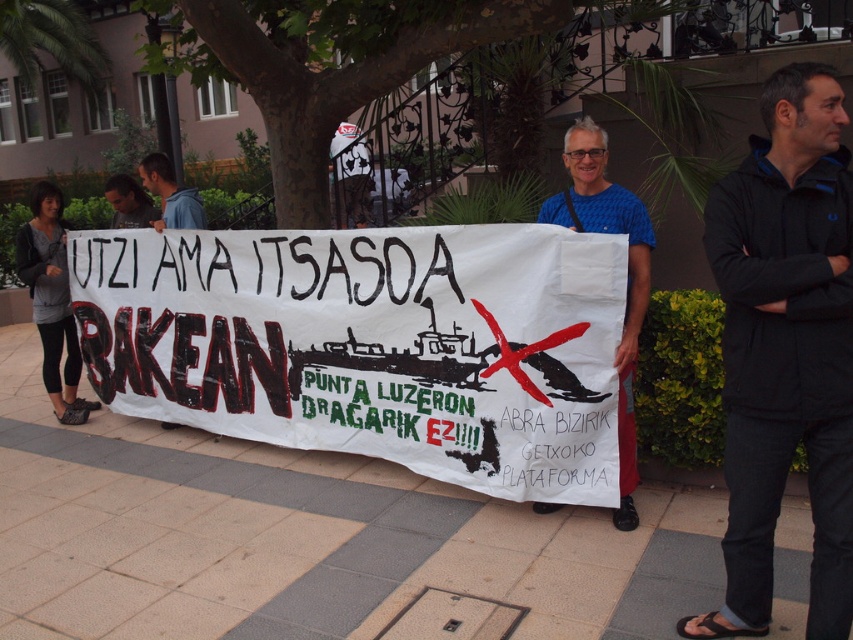
Is black fleece jacket at center above blue hoodie at center?

No.

Between black fleece jacket at center and blue hoodie at center, which one has more height?

Standing taller between the two is black fleece jacket at center.

You are a GUI agent. You are given a task and a screenshot of the screen. Output one action in this format:
    pyautogui.click(x=<x>, y=<y>)
    Task: Click on the black fleece jacket at center
    The image size is (853, 640).
    Given the screenshot: What is the action you would take?
    pyautogui.click(x=785, y=349)

Where is `black fleece jacket at center`? This screenshot has width=853, height=640. black fleece jacket at center is located at coordinates (785, 349).

Can you confirm if white paper banner at center is bigger than blue hoodie at center?

Yes.

Can you confirm if white paper banner at center is shorter than blue hoodie at center?

Incorrect, white paper banner at center's height does not fall short of blue hoodie at center's.

You are a GUI agent. You are given a task and a screenshot of the screen. Output one action in this format:
    pyautogui.click(x=<x>, y=<y>)
    Task: Click on the white paper banner at center
    The image size is (853, 640).
    Given the screenshot: What is the action you would take?
    pyautogui.click(x=370, y=344)

Based on the photo, is blue fabric at center to the left of dark blue hoodie at upper left from the viewer's perspective?

In fact, blue fabric at center is to the right of dark blue hoodie at upper left.

Is point (601, 145) less distant than point (115, 208)?

Yes, it is in front of point (115, 208).

Is point (578, 163) positioned behind point (131, 214)?

No, (578, 163) is closer to viewer.

The width and height of the screenshot is (853, 640). In order to click on blue fabric at center in this screenshot , I will do `click(627, 273)`.